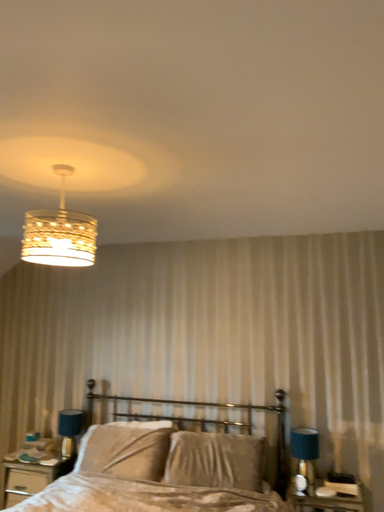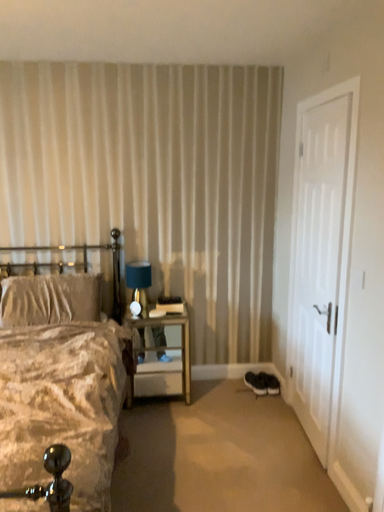
Question: How did the camera likely rotate when shooting the video?

Choices:
 (A) rotated right
 (B) rotated left

Answer: (A)